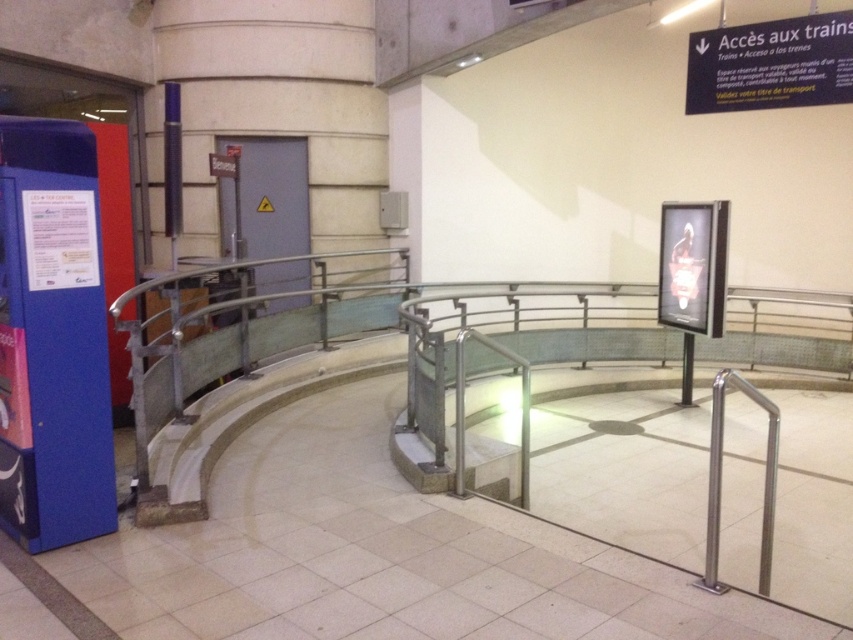
You are a delivery person carrying a box that is 1 meter wide. You need to navigate through the space between the blue plastic vending machine at left and the white plastic sign at upper right. Can your box fit through the space between them?

The blue plastic vending machine at left is thinner than the white plastic sign at upper right. Since the box is 1 meter wide, it depends on the actual width of the space between them. However, since the vending machine is thinner, it might allow enough space for the box to pass through if the distance between them is at least 1 meter. Without exact measurements, it is uncertain, but the thinner vending machine suggests there could be sufficient clearance.

You are navigating through a train station and need to reach a specific destination. You see two points marked on the floor at coordinates point (30,406) and point (689,93). Which point is closer to your current position if you are standing at the entrance near the blue kiosk on the left?

Point (30,406) is closer to your current position because it is in front of point (689,93), meaning it is nearer to the entrance where you are standing.